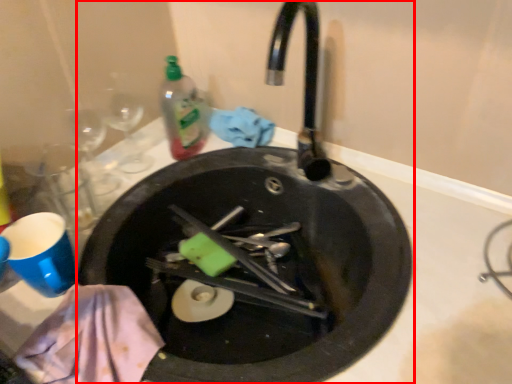
Question: In this image, where is sink (annotated by the red box) located relative to bottle?

Choices:
 (A) right
 (B) left

Answer: (A)